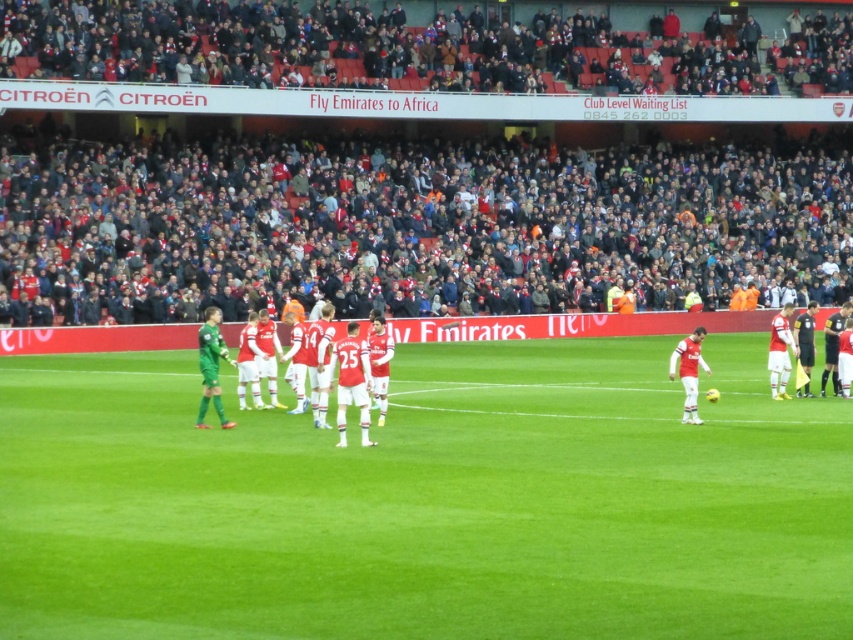
Question: Is green grass field at center thinner than matte white jersey at right?

Choices:
 (A) yes
 (B) no

Answer: (B)

Question: Which object is farther from the camera taking this photo?

Choices:
 (A) matte white jersey at right
 (B) green grass field at center

Answer: (A)

Question: Is green grass field at center further to the viewer compared to matte white jersey at right?

Choices:
 (A) yes
 (B) no

Answer: (B)

Question: Which point is farther to the camera?

Choices:
 (A) (321, 221)
 (B) (212, 387)
 (C) (683, 408)

Answer: (A)

Question: Is dark gray crowd at upper center wider than white jersey players at center?

Choices:
 (A) yes
 (B) no

Answer: (A)

Question: Among these objects, which one is farthest from the camera?

Choices:
 (A) white jersey players at center
 (B) green grass field at center
 (C) matte white jersey at right
 (D) dark gray crowd at upper center

Answer: (D)